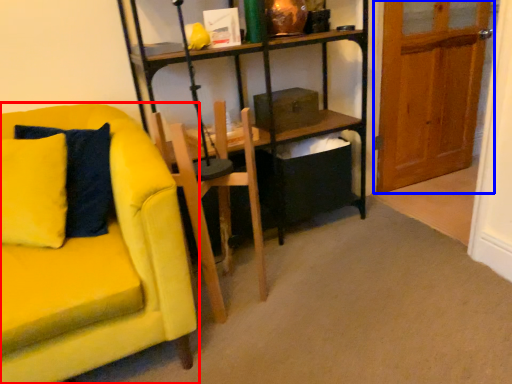
Question: Which object is closer to the camera taking this photo, chair (highlighted by a red box) or door (highlighted by a blue box)?

Choices:
 (A) chair
 (B) door

Answer: (A)